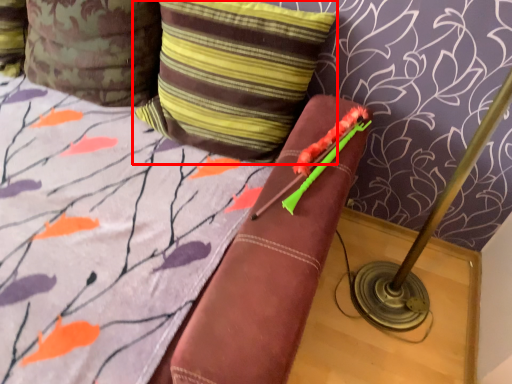
Question: Considering the relative positions of pillow (annotated by the red box) and pillow in the image provided, where is pillow (annotated by the red box) located with respect to the staircase?

Choices:
 (A) left
 (B) right

Answer: (B)